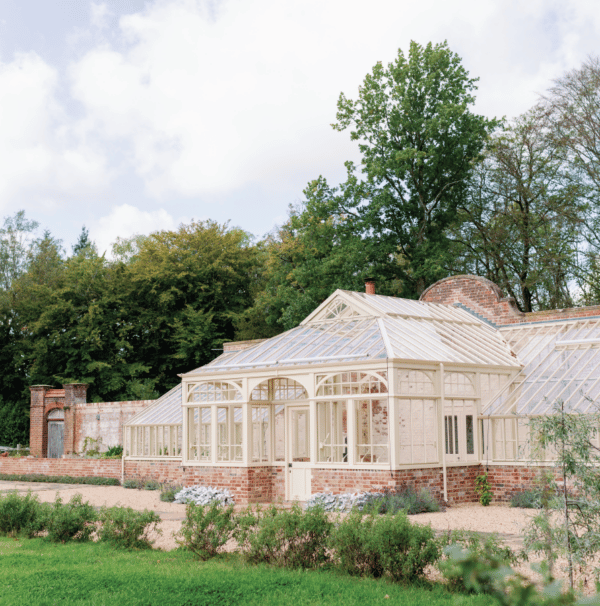
Locate an element on the screen. This screenshot has height=606, width=600. brick wall far left center is located at coordinates (102, 423).